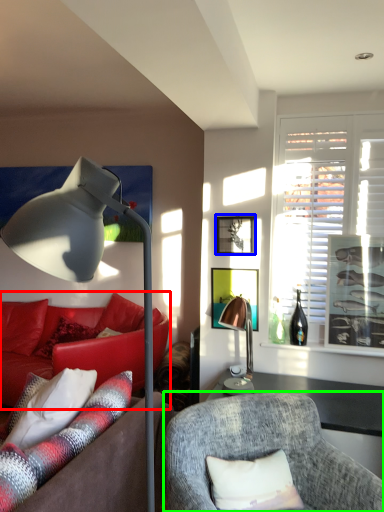
Question: Considering the real-world distances, which object is closest to studio couch (highlighted by a red box)? picture frame (highlighted by a blue box) or chair (highlighted by a green box).

Choices:
 (A) picture frame
 (B) chair

Answer: (A)